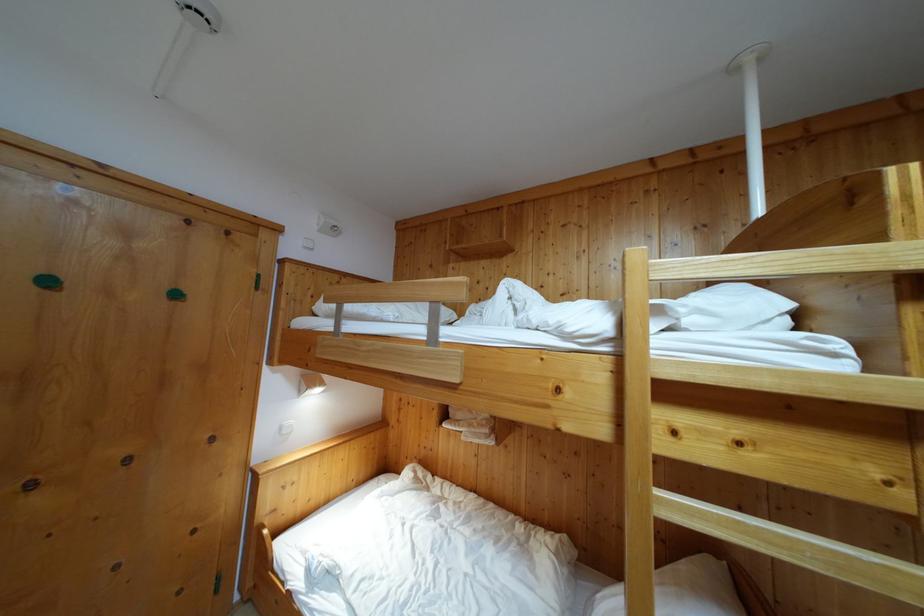
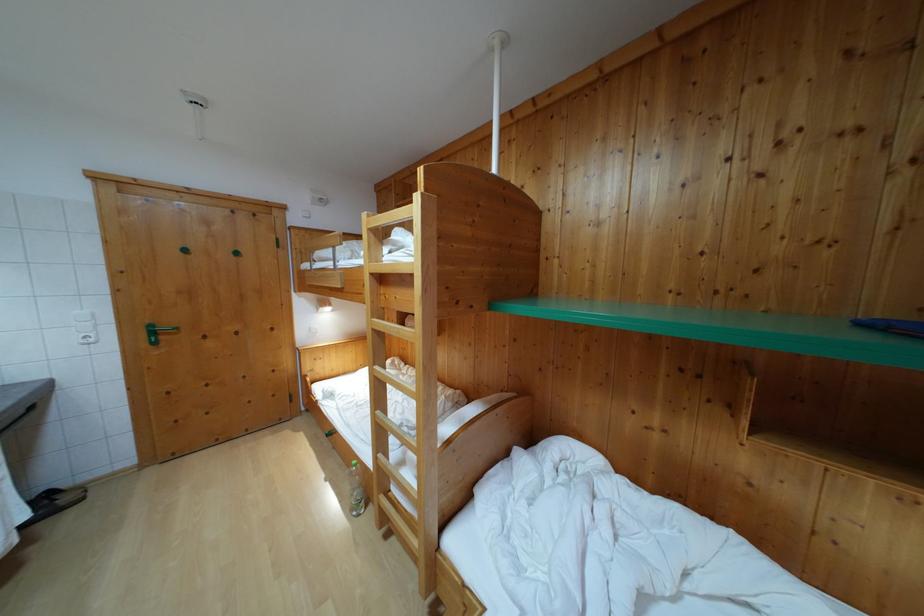
Locate, in the second image, the point that corresponds to the point at 53,290 in the first image.

(189, 257)